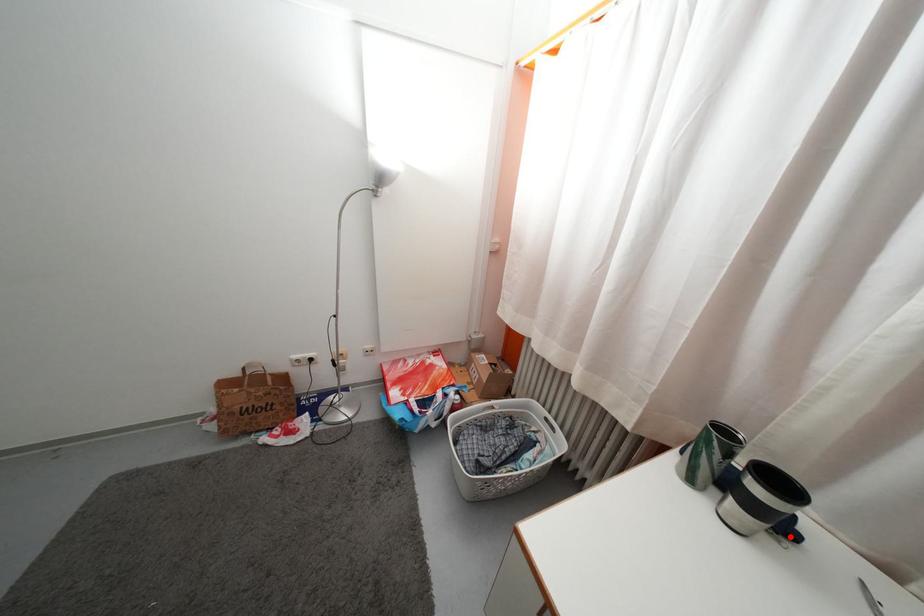
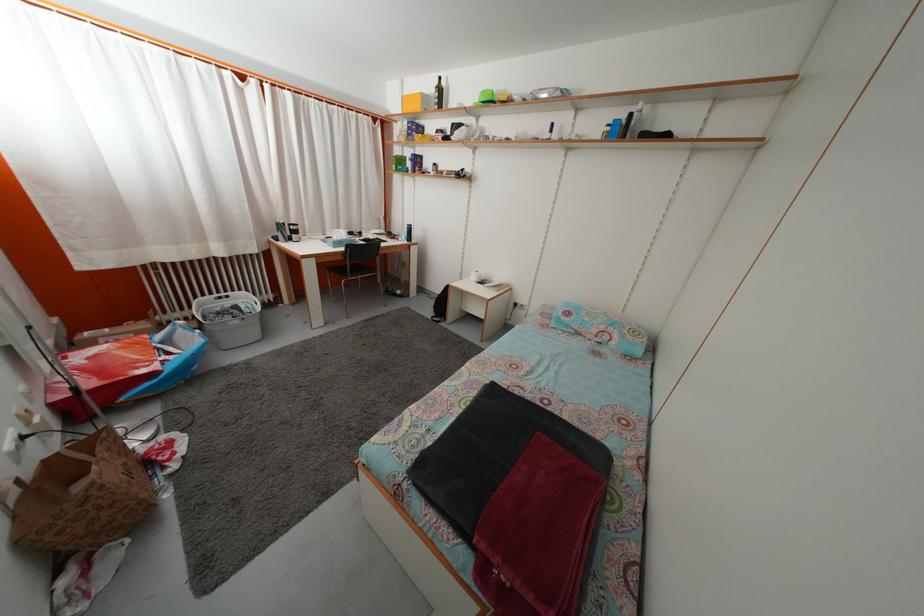
Question: I am providing you with two images of the same scene from different viewpoints. A red point is marked on the first image. Is the red point's position out of view in image 2?

Choices:
 (A) Yes
 (B) No

Answer: (A)